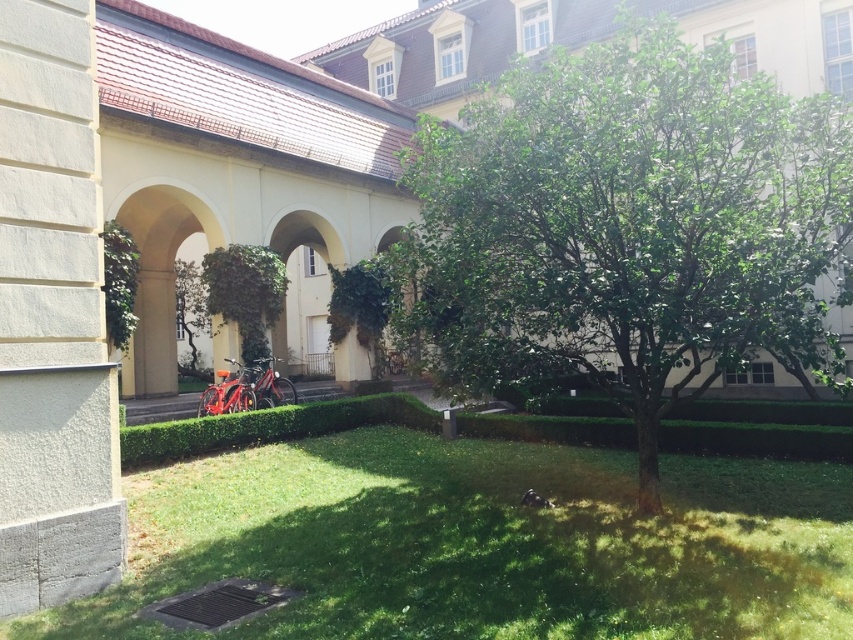
Question: Does green leafy tree at center lie in front of green leafy hedge at center?

Choices:
 (A) no
 (B) yes

Answer: (B)

Question: Which point is closer to the camera?

Choices:
 (A) green leafy tree at center
 (B) green grass at lower center
 (C) green leafy hedge at center

Answer: (B)

Question: Which of the following is the closest to the observer?

Choices:
 (A) green grass at lower center
 (B) green leafy hedge at center
 (C) green leafy tree at center

Answer: (A)

Question: Is green grass at lower center positioned at the back of green leafy hedge at center?

Choices:
 (A) no
 (B) yes

Answer: (A)

Question: Does green leafy tree at center have a larger size compared to green leafy hedge at center?

Choices:
 (A) no
 (B) yes

Answer: (A)

Question: Which object is the farthest from the green grass at lower center?

Choices:
 (A) green leafy hedge at center
 (B) green leafy tree at center

Answer: (A)